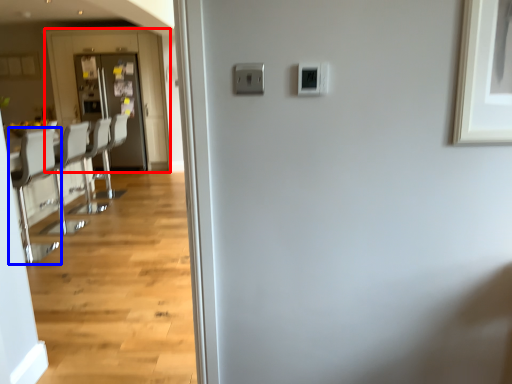
Question: Which object is closer to the camera taking this photo, screen door (highlighted by a red box) or chair (highlighted by a blue box)?

Choices:
 (A) screen door
 (B) chair

Answer: (B)